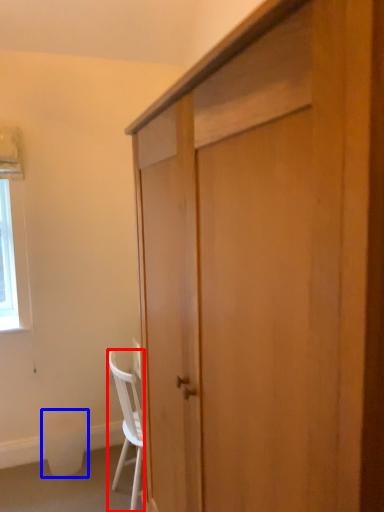
Question: Which point is further to the camera, chair (highlighted by a red box) or trash bin/can (highlighted by a blue box)?

Choices:
 (A) chair
 (B) trash bin/can

Answer: (B)